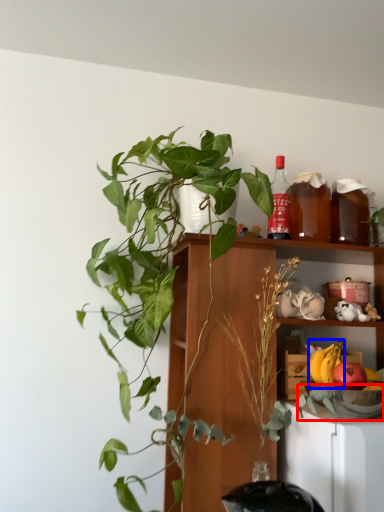
Question: Which point is further to the camera, glass bowl (highlighted by a red box) or banana (highlighted by a blue box)?

Choices:
 (A) glass bowl
 (B) banana

Answer: (B)